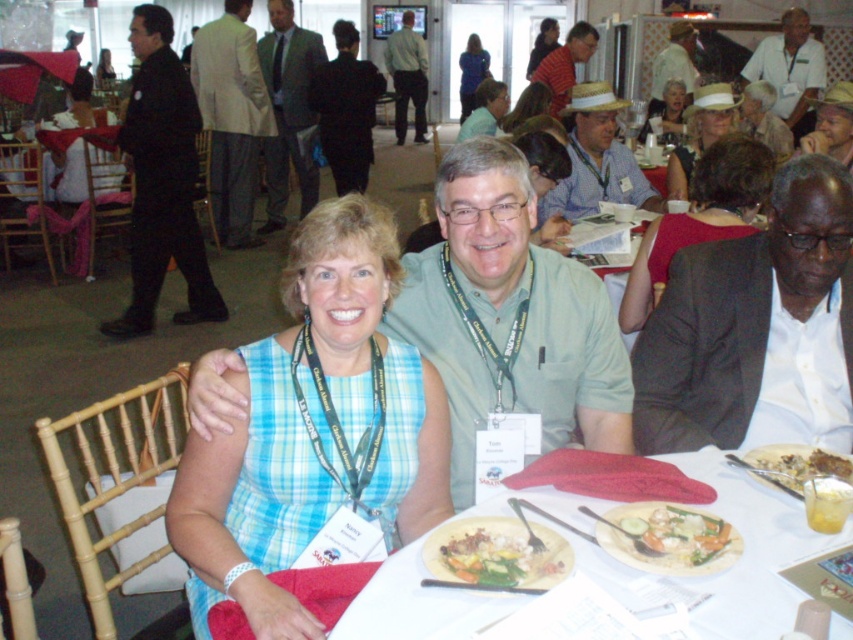
Does dark gray suit at right have a greater height compared to green textured suit at center?

No.

Consider the image. Is dark gray suit at right positioned in front of green textured suit at center?

Yes, dark gray suit at right is closer to the viewer.

Is point (726, 288) positioned in front of point (294, 128)?

Yes, it is in front of point (294, 128).

You are a GUI agent. You are given a task and a screenshot of the screen. Output one action in this format:
    pyautogui.click(x=<x>, y=<y>)
    Task: Click on the dark gray suit at right
    The image size is (853, 640).
    Given the screenshot: What is the action you would take?
    pyautogui.click(x=756, y=328)

Is matte black dress at center bigger than white straw hat at upper center?

Incorrect, matte black dress at center is not larger than white straw hat at upper center.

Can you confirm if matte black dress at center is wider than white straw hat at upper center?

In fact, matte black dress at center might be narrower than white straw hat at upper center.

Does point (657, 298) lie in front of point (712, 131)?

Yes, it is in front of point (712, 131).

Where is `matte black dress at center`? matte black dress at center is located at coordinates (699, 218).

Does blue plaid dress at center have a smaller size compared to matte gold necklace at upper center?

Indeed, blue plaid dress at center has a smaller size compared to matte gold necklace at upper center.

Who is taller, blue plaid dress at center or matte gold necklace at upper center?

With more height is blue plaid dress at center.

What do you see at coordinates (312, 428) in the screenshot? I see `blue plaid dress at center` at bounding box center [312, 428].

Find the location of `blue plaid dress at center`. blue plaid dress at center is located at coordinates (312, 428).